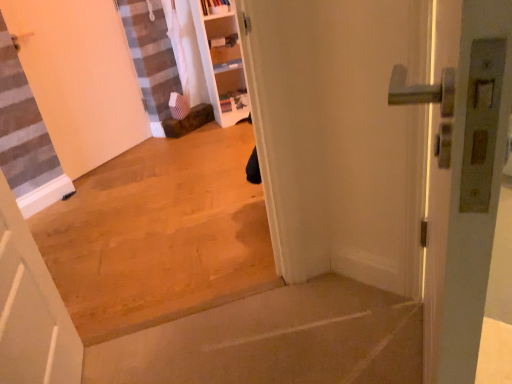
Question: Is the position of white matte door at left, which ranks as the third door in right-to-left order, less distant than that of metallic silver handle at right, which is the third door from left to right?

Choices:
 (A) yes
 (B) no

Answer: (B)

Question: Does white matte door at left, which ranks as the third door in right-to-left order, contain metallic silver handle at right, the first door viewed from the right?

Choices:
 (A) yes
 (B) no

Answer: (B)

Question: Are white matte door at left, positioned as the 1th door in left-to-right order, and metallic silver handle at right, which is the 2th door from front to back, located far from each other?

Choices:
 (A) yes
 (B) no

Answer: (A)

Question: From a real-world perspective, is white matte door at left, which ranks as the third door in right-to-left order, on top of metallic silver handle at right, which is counted as the 2th door, starting from the back?

Choices:
 (A) no
 (B) yes

Answer: (B)

Question: Is white matte door at left, which is the 1th door from back to front, at the right side of metallic silver handle at right, which is the third door from left to right?

Choices:
 (A) no
 (B) yes

Answer: (A)

Question: From the image's perspective, does white matte door at left, which ranks as the third door in right-to-left order, appear higher than metallic silver handle at right, the first door viewed from the right?

Choices:
 (A) no
 (B) yes

Answer: (B)

Question: Is metallic silver handle at right, which is the third door from left to right, wider than white matte door at lower left, the second door from the right?

Choices:
 (A) no
 (B) yes

Answer: (A)

Question: Is metallic silver handle at right, which is the 2th door from front to back, next to white matte door at lower left, which ranks as the third door in back-to-front order, and touching it?

Choices:
 (A) yes
 (B) no

Answer: (B)

Question: From a real-world perspective, is metallic silver handle at right, which is counted as the 2th door, starting from the back, beneath white matte door at lower left, which appears as the second door when viewed from the left?

Choices:
 (A) yes
 (B) no

Answer: (A)

Question: Can we say metallic silver handle at right, which is the 2th door from front to back, lies outside white matte door at lower left, the second door from the right?

Choices:
 (A) yes
 (B) no

Answer: (A)

Question: Is metallic silver handle at right, which is the 2th door from front to back, further to the viewer compared to white matte door at lower left, which appears as the second door when viewed from the left?

Choices:
 (A) yes
 (B) no

Answer: (A)

Question: From the image's perspective, does metallic silver handle at right, which is counted as the 2th door, starting from the back, appear lower than white matte door at lower left, the 1th door in the front-to-back sequence?

Choices:
 (A) yes
 (B) no

Answer: (B)

Question: Can you confirm if smooth concrete step at lower center, acting as the 2th concrete starting from the top, is positioned to the right of brown wood floor at center, acting as the second concrete starting from the bottom?

Choices:
 (A) yes
 (B) no

Answer: (A)